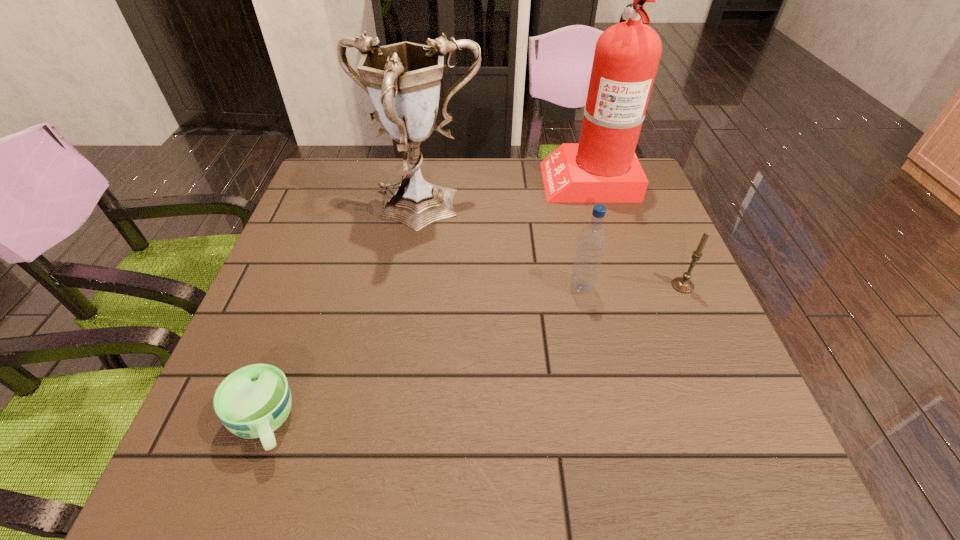
Image resolution: width=960 pixels, height=540 pixels. What are the coordinates of `fire extinguisher` in the screenshot? It's located at [602, 168].

Identify the location of the second tallest object. (403, 80).

You are a GUI agent. You are given a task and a screenshot of the screen. Output one action in this format:
    pyautogui.click(x=<x>, y=<y>)
    Task: Click on the third shortest object
    Image resolution: width=960 pixels, height=540 pixels.
    Given the screenshot: What is the action you would take?
    [x=592, y=240]

Where is `candle`? candle is located at coordinates (682, 284).

In order to click on the shortest object in this screenshot , I will do `click(252, 402)`.

Where is `the nearest object`? the nearest object is located at coordinates (252, 402).

Locate an element on the screen. free space located 0.130m on the front-facing side of the fire extinguisher is located at coordinates (498, 179).

Identify the location of free space located 0.380m on the front-facing side of the fire extinguisher. (412, 179).

The width and height of the screenshot is (960, 540). In order to click on vacant space positioned 0.280m on the front-facing side of the fire extinguisher in this screenshot , I will do `click(446, 179)`.

Identify the location of blank area located 0.070m on the left of the trophy cup. This screenshot has width=960, height=540. (332, 211).